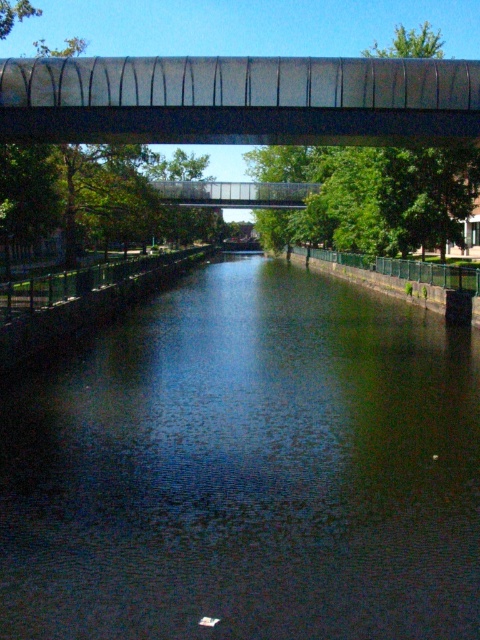
You are a tourist standing on the bank of the canal and want to take a photo of the metallic gray bridge at upper center. However, you notice that the dark reflective water at center might be obstructing your view. Can you still see the bridge clearly through the water?

The dark reflective water at center is in front of the metallic gray bridge at upper center, so the water is between you and the bridge, making it difficult to see the bridge clearly through the water.

You are a delivery drone flying over the canal and need to pass through the area between the dark reflective water at center and the transparent glass bridge at center. Can you safely pass through this space without hitting anything?

The dark reflective water at center is shorter than the transparent glass bridge at center, so the drone can safely pass through the space between them as the water is lower than the bridge.

You are a delivery drone with a wingspan of 1.5 meters. You need to fly over the dark reflective water at center and the transparent glass bridge at center. Can you safely pass between them without hitting either object?

The dark reflective water at center and transparent glass bridge at center are 51.59 meters apart from each other. Since your wingspan is only 1.5 meters, there is ample space for you to safely navigate between them without any risk of collision.